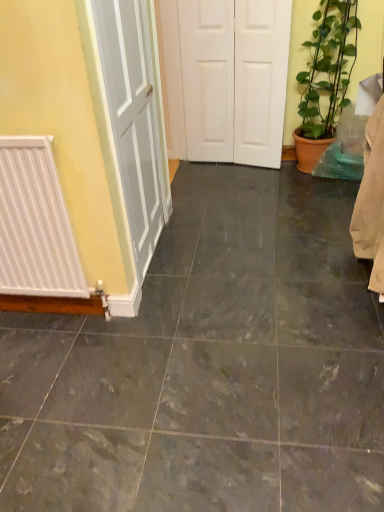
The width and height of the screenshot is (384, 512). Identify the location of free point below white matte radiator at left (from a real-world perspective). 46,318.